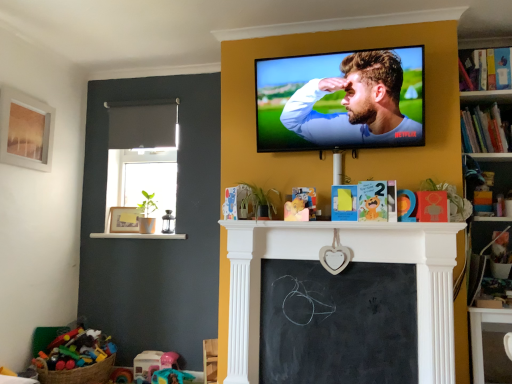
Question: Is hardcover book at upper right, the first book positioned from the bottom, not within black chalkboard at center?

Choices:
 (A) yes
 (B) no

Answer: (A)

Question: From the image's perspective, is hardcover book at upper right, which is the second book from top to bottom, beneath black chalkboard at center?

Choices:
 (A) yes
 (B) no

Answer: (B)

Question: Can you confirm if hardcover book at upper right, which is the second book from top to bottom, is smaller than black chalkboard at center?

Choices:
 (A) yes
 (B) no

Answer: (B)

Question: From the image's perspective, is hardcover book at upper right, the first book positioned from the bottom, on top of black chalkboard at center?

Choices:
 (A) yes
 (B) no

Answer: (A)

Question: Is hardcover book at upper right, the first book positioned from the bottom, far from black chalkboard at center?

Choices:
 (A) no
 (B) yes

Answer: (B)

Question: Is hardcover book at upper right, the first book positioned from the bottom, to the right of black chalkboard at center from the viewer's perspective?

Choices:
 (A) no
 (B) yes

Answer: (B)

Question: Is hardcover book at upper right, the second book ordered from the bottom, not within matte wooden picture frame at left, marked as the first picture frame in a back-to-front arrangement?

Choices:
 (A) no
 (B) yes

Answer: (B)

Question: Does hardcover book at upper right, the second book ordered from the bottom, appear on the left side of matte wooden picture frame at left, the 1th picture frame from the right?

Choices:
 (A) no
 (B) yes

Answer: (A)

Question: Is the position of hardcover book at upper right, the 1th book when ordered from top to bottom, less distant than that of matte wooden picture frame at left, positioned as the 2th picture frame in front-to-back order?

Choices:
 (A) yes
 (B) no

Answer: (A)

Question: Is hardcover book at upper right, the 1th book when ordered from top to bottom, behind matte wooden picture frame at left, positioned as the 2th picture frame in front-to-back order?

Choices:
 (A) yes
 (B) no

Answer: (B)

Question: Can you confirm if hardcover book at upper right, the second book ordered from the bottom, is positioned to the right of matte wooden picture frame at left, positioned as the first picture frame in bottom-to-top order?

Choices:
 (A) no
 (B) yes

Answer: (B)

Question: Does hardcover book at upper right, the second book ordered from the bottom, have a smaller size compared to matte wooden picture frame at left, the second picture frame viewed from the top?

Choices:
 (A) no
 (B) yes

Answer: (A)

Question: Can you confirm if matte wooden picture frame at upper left, positioned as the 2th picture frame in bottom-to-top order, is bigger than white glossy ledge at lower left?

Choices:
 (A) yes
 (B) no

Answer: (A)